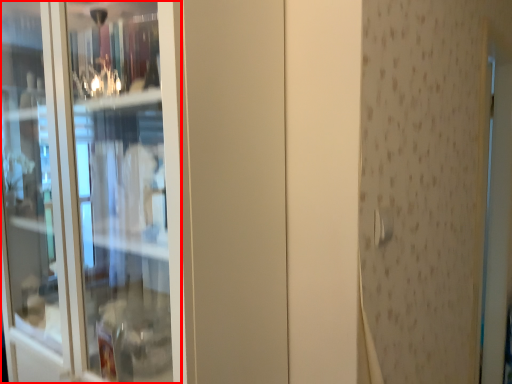
Question: Considering the relative positions of screen door (annotated by the red box) and door handle in the image provided, where is screen door (annotated by the red box) located with respect to the staircase?

Choices:
 (A) right
 (B) left

Answer: (B)